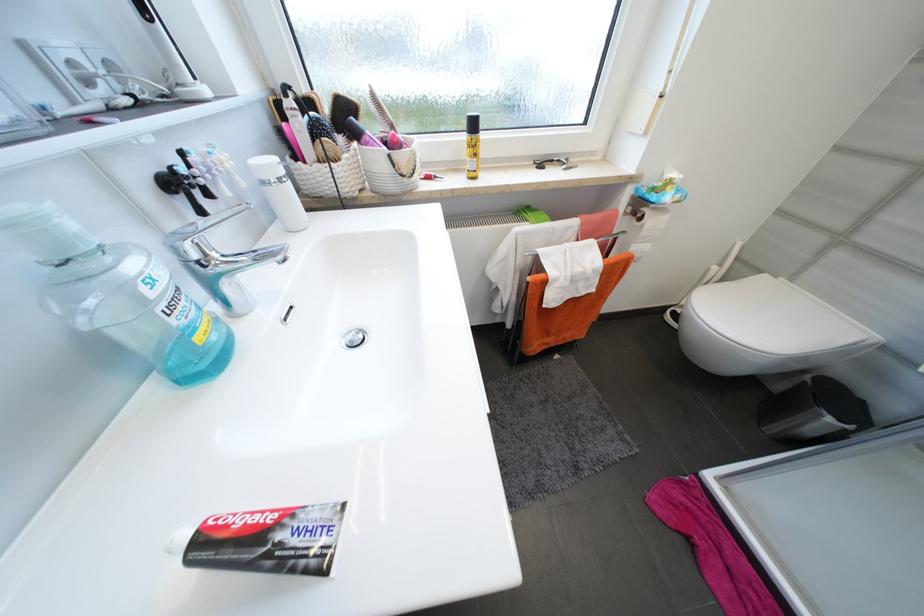
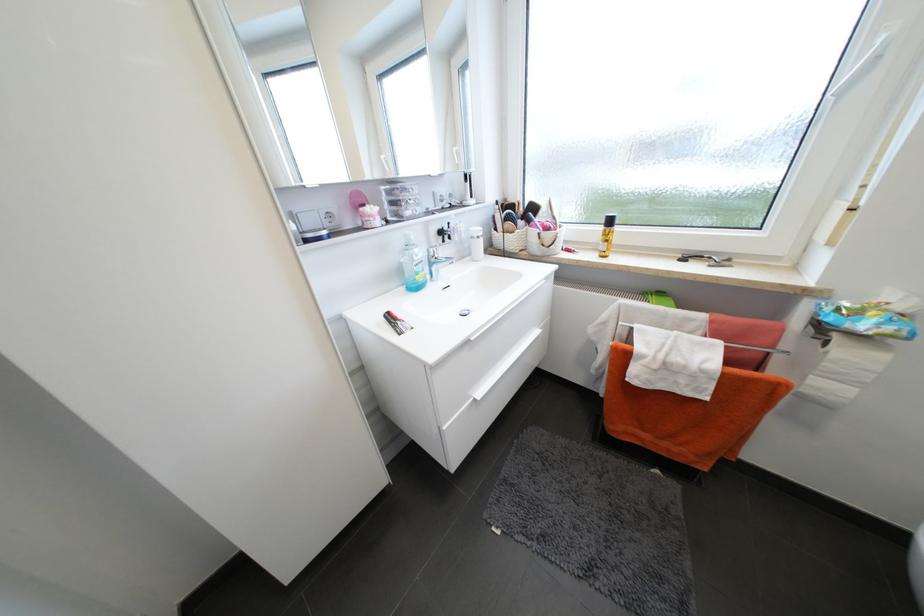
The point at (203, 339) is marked in the first image. Where is the corresponding point in the second image?

(423, 278)